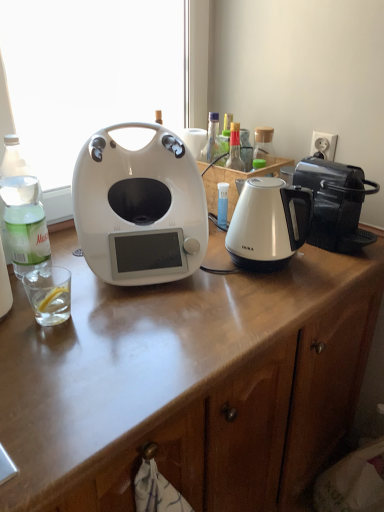
This screenshot has width=384, height=512. In order to click on empty space that is ontop of black plastic toaster at right (from a real-world perspective) in this screenshot , I will do `click(325, 168)`.